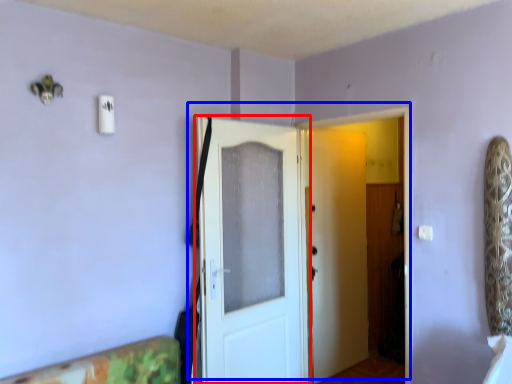
Question: Which object appears farthest to the camera in this image, door (highlighted by a red box) or door (highlighted by a blue box)?

Choices:
 (A) door
 (B) door

Answer: (A)